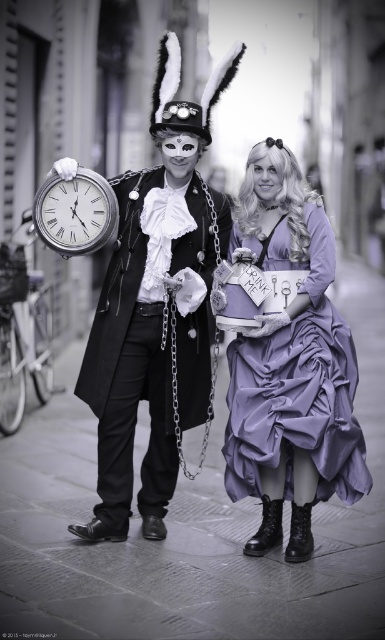
Between lavender satin dress at center and silver metallic clock at center, which one appears on the right side from the viewer's perspective?

Positioned to the right is lavender satin dress at center.

Who is higher up, lavender satin dress at center or silver metallic clock at center?

Positioned higher is silver metallic clock at center.

What do you see at coordinates (296, 378) in the screenshot?
I see `lavender satin dress at center` at bounding box center [296, 378].

Find the location of a particular element. Image resolution: width=385 pixels, height=640 pixels. lavender satin dress at center is located at coordinates (296, 378).

Can you confirm if matte black coat at center is taller than silver metallic clock at center?

Yes, matte black coat at center is taller than silver metallic clock at center.

At what (x,y) coordinates should I click in order to perform the action: click on matte black coat at center. Please return your answer as a coordinate pair (x, y). Looking at the image, I should click on (155, 307).

Is point (165, 266) more distant than point (324, 305)?

Yes, point (165, 266) is farther from viewer.

Can you confirm if matte black coat at center is bigger than lavender satin dress at center?

Correct, matte black coat at center is larger in size than lavender satin dress at center.

Which is behind, point (135, 188) or point (224, 477)?

The point (135, 188) is more distant.

The height and width of the screenshot is (640, 385). What are the coordinates of `matte black coat at center` in the screenshot? It's located at (155, 307).